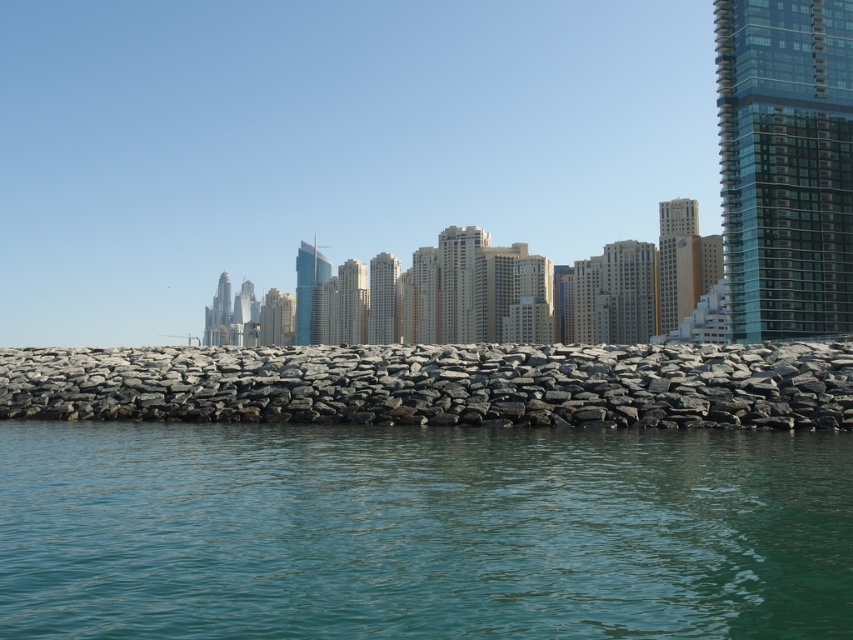
Between clear water at center and gray rock wall at center, which one appears on the left side from the viewer's perspective?

Positioned to the left is gray rock wall at center.

Which is above, clear water at center or gray rock wall at center?

gray rock wall at center is above.

Between point (55, 424) and point (703, 378), which one is positioned behind?

Positioned behind is point (55, 424).

You are a GUI agent. You are given a task and a screenshot of the screen. Output one action in this format:
    pyautogui.click(x=<x>, y=<y>)
    Task: Click on the clear water at center
    This screenshot has width=853, height=640.
    Given the screenshot: What is the action you would take?
    pyautogui.click(x=421, y=531)